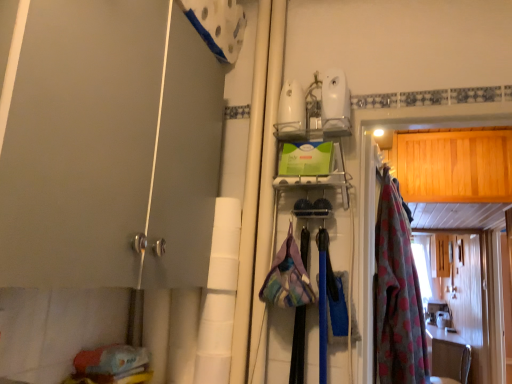
Question: Is pink floral fabric at right turned away from white glossy countertop at lower right?

Choices:
 (A) yes
 (B) no

Answer: (B)

Question: From the image's perspective, would you say pink floral fabric at right is shown under white glossy countertop at lower right?

Choices:
 (A) no
 (B) yes

Answer: (A)

Question: From a real-world perspective, is pink floral fabric at right located higher than white glossy countertop at lower right?

Choices:
 (A) yes
 (B) no

Answer: (A)

Question: Does pink floral fabric at right appear on the left side of white glossy countertop at lower right?

Choices:
 (A) no
 (B) yes

Answer: (B)

Question: Considering the relative sizes of pink floral fabric at right and white glossy countertop at lower right in the image provided, is pink floral fabric at right smaller than white glossy countertop at lower right?

Choices:
 (A) yes
 (B) no

Answer: (A)

Question: From a real-world perspective, does pink floral fabric at right sit lower than white glossy countertop at lower right?

Choices:
 (A) yes
 (B) no

Answer: (B)

Question: Is pink floral fabric at right placed right next to wooden cabinet at right?

Choices:
 (A) yes
 (B) no

Answer: (B)

Question: Is pink floral fabric at right at the left side of wooden cabinet at right?

Choices:
 (A) no
 (B) yes

Answer: (B)

Question: Is pink floral fabric at right oriented away from wooden cabinet at right?

Choices:
 (A) no
 (B) yes

Answer: (A)

Question: Is pink floral fabric at right taller than wooden cabinet at right?

Choices:
 (A) yes
 (B) no

Answer: (A)

Question: From the image's perspective, is pink floral fabric at right on top of wooden cabinet at right?

Choices:
 (A) yes
 (B) no

Answer: (A)

Question: Does pink floral fabric at right have a lesser width compared to wooden cabinet at right?

Choices:
 (A) no
 (B) yes

Answer: (B)

Question: Is wooden cabinet at right shorter than matte gray door at left?

Choices:
 (A) no
 (B) yes

Answer: (B)